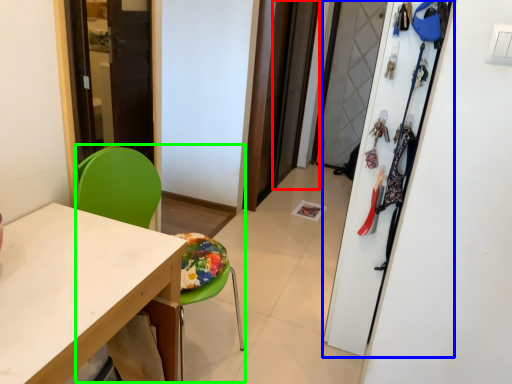
Question: Which is farther away from screen door (highlighted by a red box)? closet (highlighted by a blue box) or armchair (highlighted by a green box)?

Choices:
 (A) closet
 (B) armchair

Answer: (B)